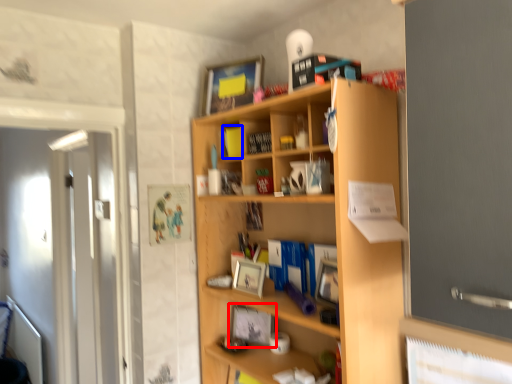
Question: Which point is further to the camera, picture frame (highlighted by a red box) or book (highlighted by a blue box)?

Choices:
 (A) picture frame
 (B) book

Answer: (B)